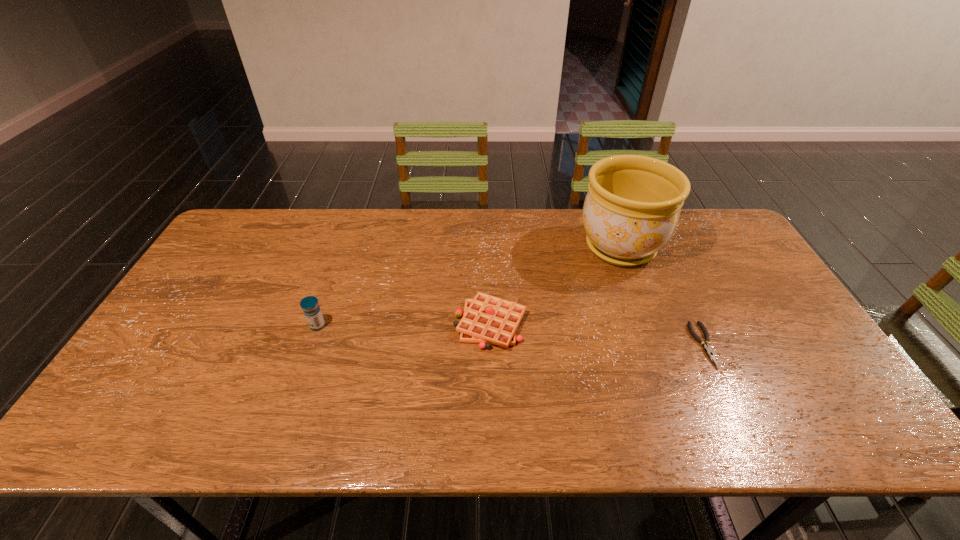
Locate an element on the screen. The width and height of the screenshot is (960, 540). flowerpot is located at coordinates (631, 210).

The height and width of the screenshot is (540, 960). Identify the location of the farthest object. (631, 210).

Identify the location of the leftmost object. (310, 306).

This screenshot has height=540, width=960. Identify the location of the second tallest object. (310, 306).

Image resolution: width=960 pixels, height=540 pixels. In order to click on waffle in this screenshot , I will do (x=487, y=319).

Identify the location of the second object from left to right. (487, 319).

Where is `pliers`? The width and height of the screenshot is (960, 540). pliers is located at coordinates (707, 348).

Locate an element on the screen. vacant space located on the left of the flowerpot is located at coordinates (461, 247).

Find the location of a particular element. This screenshot has height=540, width=960. free space located on the back of the second tallest object is located at coordinates (340, 262).

Find the location of a particular element. blank space located on the back of the waffle is located at coordinates (490, 279).